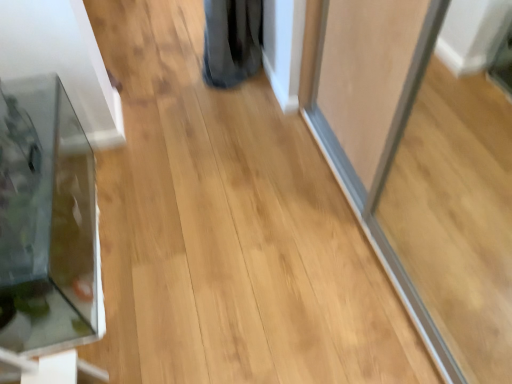
The width and height of the screenshot is (512, 384). Identify the location of vacant area that lies to the right of clear glass aquarium at left. (193, 238).